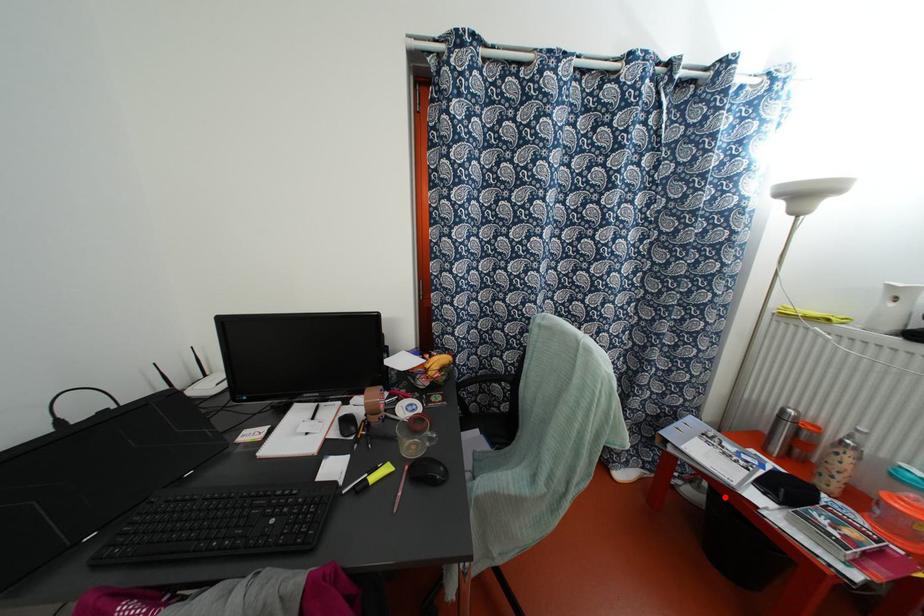
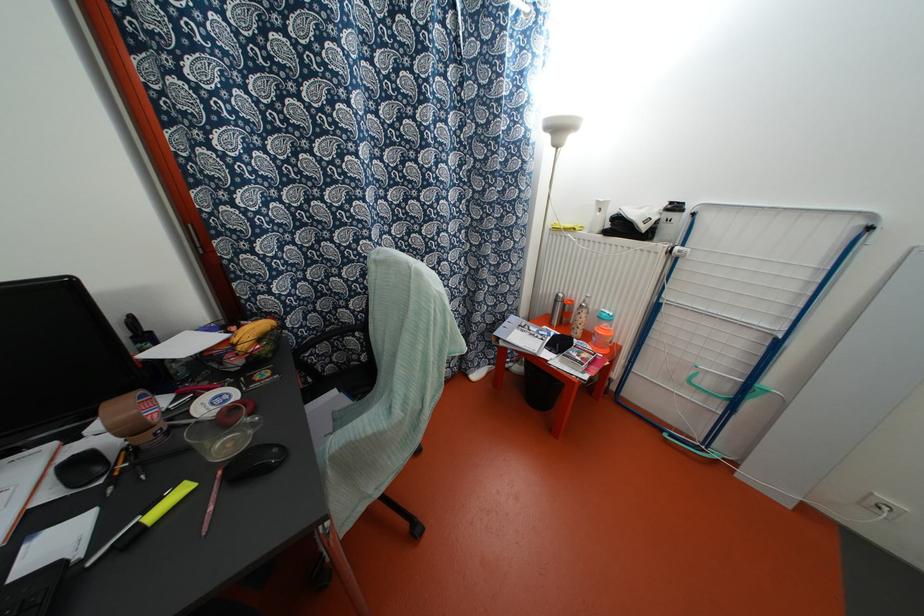
Question: I am providing you with two images of the same scene from different viewpoints. A red point is marked on the first image. Is the red point's position out of view in image 2?

Choices:
 (A) Yes
 (B) No

Answer: (B)